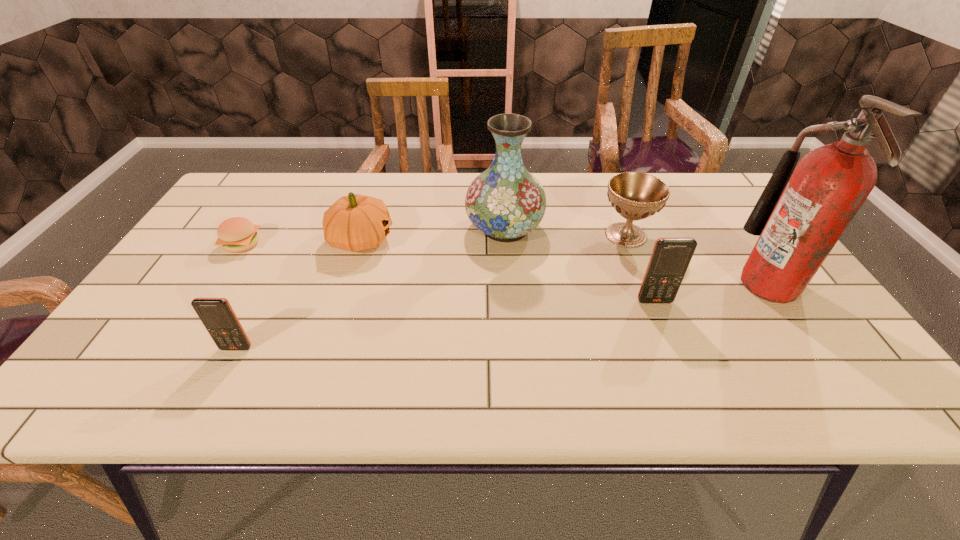
Please point a location where one more cellular_telephone can be added evenly. Please provide its 2D coordinates. Your answer should be formatted as a tuple, i.e. [(x, y)], where the tuple contains the x and y coordinates of a point satisfying the conditions above.

[(456, 323)]